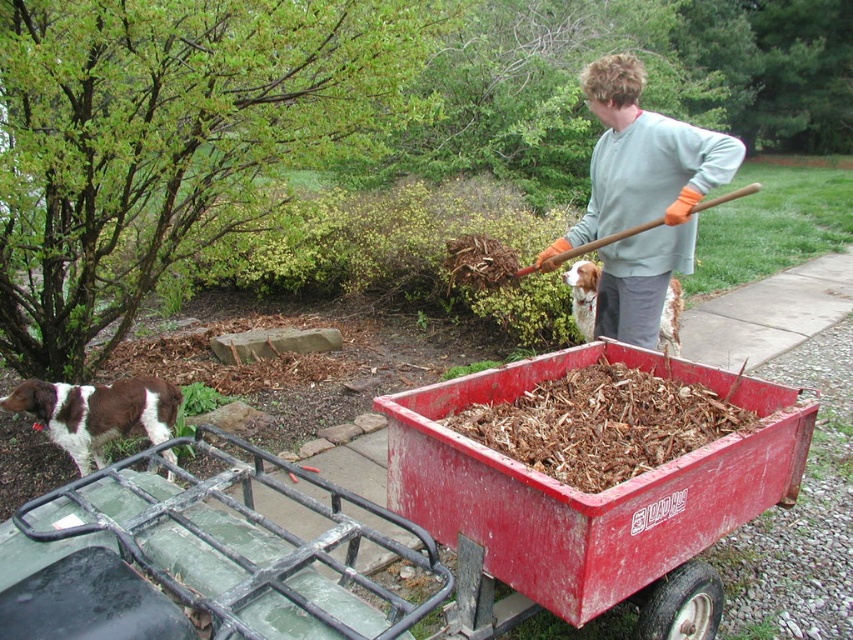
You are organizing a garden party and need to place a large centerpiece on the red plastic cart at center. However, you also have a light gray sweater at upper right that needs to be displayed. Given their sizes, which object can accommodate the larger item?

The red plastic cart at center has a larger size compared to the light gray sweater at upper right, so the red plastic cart at center can accommodate the larger item.

You are a drone operator trying to capture a photo of the light gray sweater at upper right and the brown and white fur at lower left. From the perspective of the camera, which object is positioned higher in the frame?

The light gray sweater at upper right is positioned higher in the frame than the brown and white fur at lower left.

Looking at this image, you are trying to determine if the red plastic cart at center can fit through a narrow garden path that is only as wide as the brown and white fur at lower left. Based on their widths, can the cart pass through the path?

The red plastic cart at center might be wider than brown and white fur at lower left, so it might not fit through the path if the path is only as wide as the brown and white fur at lower left.